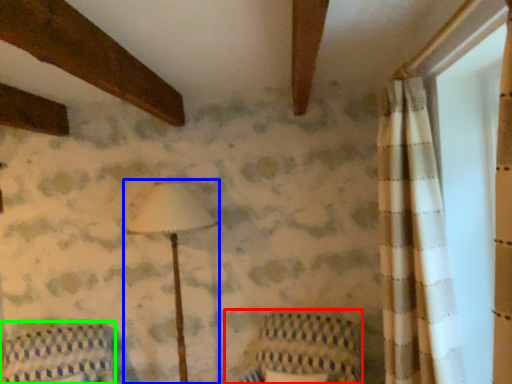
Question: Based on their relative distances, which object is nearer to armchair (highlighted by a red box)? Choose from lamp (highlighted by a blue box) and furniture (highlighted by a green box).

Choices:
 (A) lamp
 (B) furniture

Answer: (A)